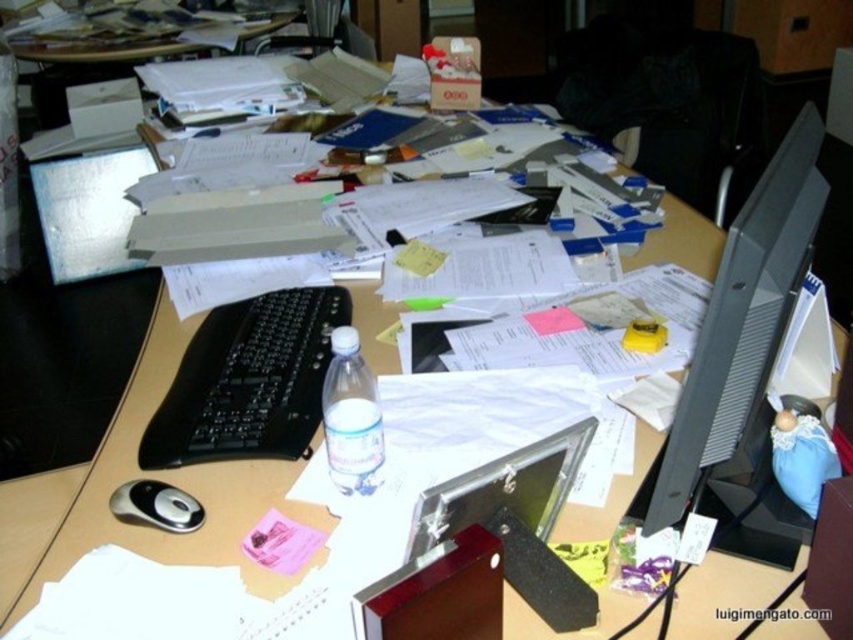
Question: Which object appears farthest from the camera in this image?

Choices:
 (A) translucent plastic water bottle at center
 (B) black glossy computer monitor at right
 (C) black plastic keyboard at center-left
 (D) wooden desk at upper center

Answer: (D)

Question: Which of the following is the closest to the observer?

Choices:
 (A) translucent plastic water bottle at center
 (B) black plastic mouse at lower left
 (C) wooden desk at upper center
 (D) black glossy computer monitor at right

Answer: (D)

Question: Does translucent plastic water bottle at center have a lesser width compared to black plastic mouse at lower left?

Choices:
 (A) yes
 (B) no

Answer: (A)

Question: Does black glossy computer monitor at right have a greater width compared to black plastic mouse at lower left?

Choices:
 (A) yes
 (B) no

Answer: (A)

Question: Is black glossy computer monitor at right closer to the viewer compared to black plastic mouse at lower left?

Choices:
 (A) yes
 (B) no

Answer: (A)

Question: Which object appears closest to the camera in this image?

Choices:
 (A) wooden desk at upper center
 (B) translucent plastic water bottle at center
 (C) black glossy computer monitor at right
 (D) black plastic keyboard at center-left

Answer: (C)